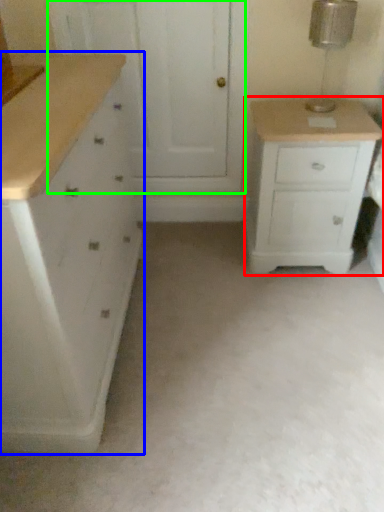
Question: Which object is the closest to the chest of drawers (highlighted by a red box)? Choose among these: chest of drawers (highlighted by a blue box) or screen door (highlighted by a green box).

Choices:
 (A) chest of drawers
 (B) screen door

Answer: (B)